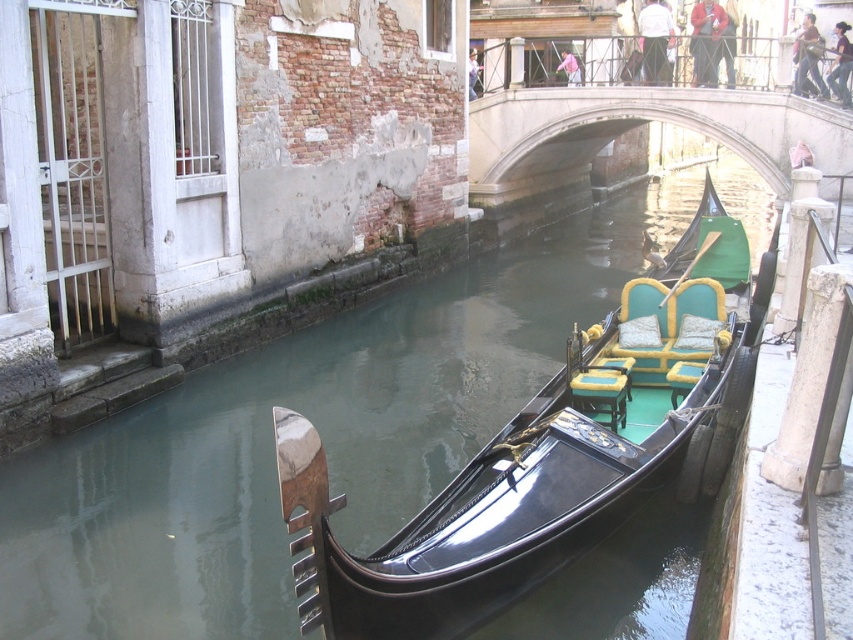
You are a tourist in Venice and want to take a photo of the shiny black gondola at center and the teal fabric cushion at center. Which object should you focus on first if you want to capture both in a single frame without moving the camera?

You should focus on the shiny black gondola at center first because it is larger than the teal fabric cushion at center, allowing both to fit within the frame more easily.

You are a tourist standing on the concrete stone bridge at center and want to take a photo of the shiny black gondola at center. Is the gondola positioned directly under the bridge where you are standing?

Yes, the shiny black gondola at center is located below the concrete stone bridge at center, so it is directly under the bridge where you are standing.

You are standing on the concrete stone bridge at center and want to place a 10 meter long wooden plank to reach the teal fabric cushion at center. Can you safely place the plank without it overhanging the water?

The distance between the concrete stone bridge at center and the teal fabric cushion at center is 10.48 meters. Since the wooden plank is only 10 meters long, it will not be long enough to span the gap safely without overhanging the water.